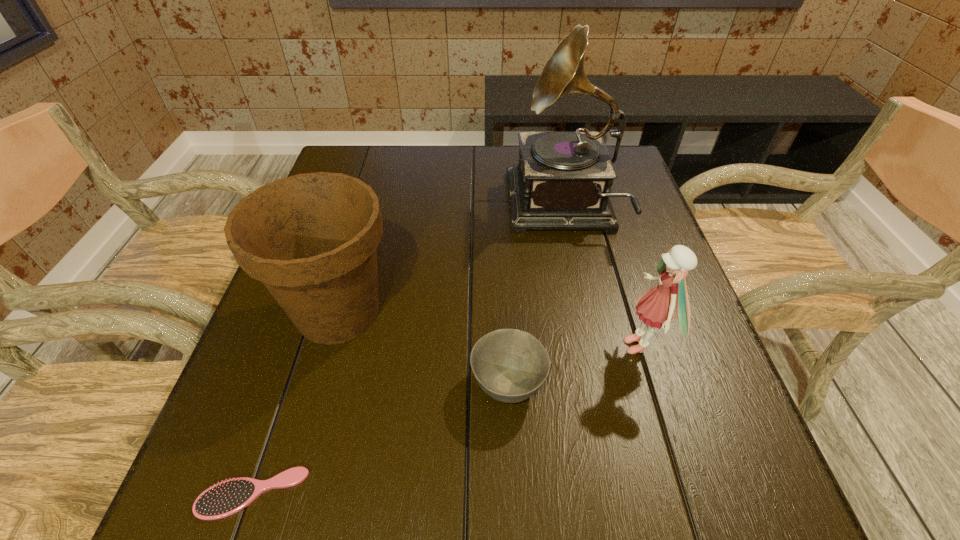
The height and width of the screenshot is (540, 960). Identify the location of object that stands as the closest to the flowerpot. 510,365.